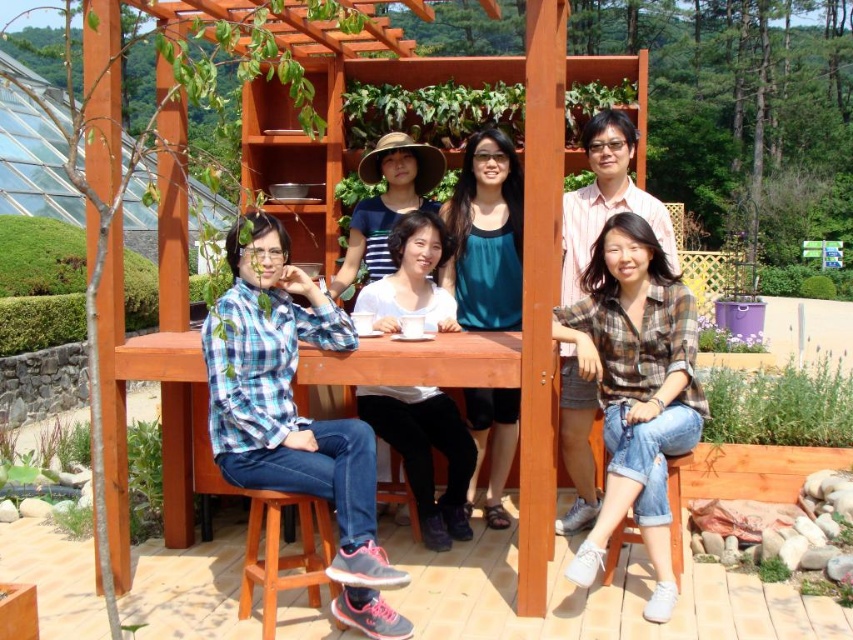
Can you confirm if wooden stool at lower left is positioned above denim stool at lower right?

Incorrect, wooden stool at lower left is not positioned above denim stool at lower right.

Describe the element at coordinates (283, 554) in the screenshot. The image size is (853, 640). I see `wooden stool at lower left` at that location.

Locate an element on the screen. wooden stool at lower left is located at coordinates (283, 554).

Is point (663, 296) farther from viewer compared to point (634, 534)?

No, it is in front of (634, 534).

Is plaid cotton shirt at center in front of denim stool at lower right?

Yes.

Locate an element on the screen. Image resolution: width=853 pixels, height=640 pixels. plaid cotton shirt at center is located at coordinates (635, 388).

Does plaid cotton shirt at center appear over wooden stool at lower left?

Indeed, plaid cotton shirt at center is positioned over wooden stool at lower left.

Does plaid cotton shirt at center have a lesser width compared to wooden stool at lower left?

No, plaid cotton shirt at center is not thinner than wooden stool at lower left.

The width and height of the screenshot is (853, 640). What do you see at coordinates (635, 388) in the screenshot?
I see `plaid cotton shirt at center` at bounding box center [635, 388].

This screenshot has height=640, width=853. In order to click on plaid cotton shirt at center in this screenshot , I will do `click(635, 388)`.